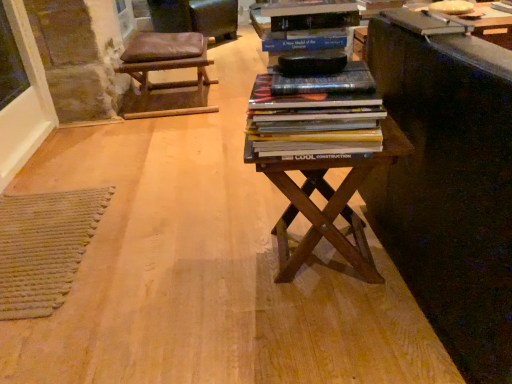
Question: Does brown leather stool at upper left have a lesser height compared to brown wooden table at center?

Choices:
 (A) yes
 (B) no

Answer: (B)

Question: Could you tell me if brown leather stool at upper left is turned towards brown wooden table at center?

Choices:
 (A) yes
 (B) no

Answer: (B)

Question: Is brown wooden table at center located within brown leather stool at upper left?

Choices:
 (A) no
 (B) yes

Answer: (A)

Question: Does brown leather stool at upper left lie behind brown wooden table at center?

Choices:
 (A) no
 (B) yes

Answer: (B)

Question: Is brown leather stool at upper left far away from brown wooden table at center?

Choices:
 (A) no
 (B) yes

Answer: (B)

Question: Does point (373, 105) appear closer or farther from the camera than point (222, 18)?

Choices:
 (A) closer
 (B) farther

Answer: (A)

Question: Looking at their shapes, would you say hardcover books at center is wider or thinner than brown leather stool at upper left?

Choices:
 (A) wide
 (B) thin

Answer: (B)

Question: From a real-world perspective, relative to brown leather stool at upper left, is hardcover books at center vertically above or below?

Choices:
 (A) above
 (B) below

Answer: (A)

Question: From the image's perspective, relative to brown leather stool at upper left, is hardcover books at center above or below?

Choices:
 (A) above
 (B) below

Answer: (B)

Question: Relative to brown leather stool at upper left, is hardcover book at upper right in front or behind?

Choices:
 (A) front
 (B) behind

Answer: (A)

Question: From their relative heights in the image, would you say hardcover book at upper right is taller or shorter than brown leather stool at upper left?

Choices:
 (A) tall
 (B) short

Answer: (B)

Question: Is point (449, 33) positioned closer to the camera than point (150, 59)?

Choices:
 (A) farther
 (B) closer

Answer: (B)

Question: Is hardcover book at upper right to the left or to the right of brown leather stool at upper left in the image?

Choices:
 (A) right
 (B) left

Answer: (A)

Question: Does point (268, 127) appear closer or farther from the camera than point (410, 21)?

Choices:
 (A) farther
 (B) closer

Answer: (B)

Question: From the image's perspective, is brown wooden table at center above or below hardcover book at upper right?

Choices:
 (A) below
 (B) above

Answer: (A)